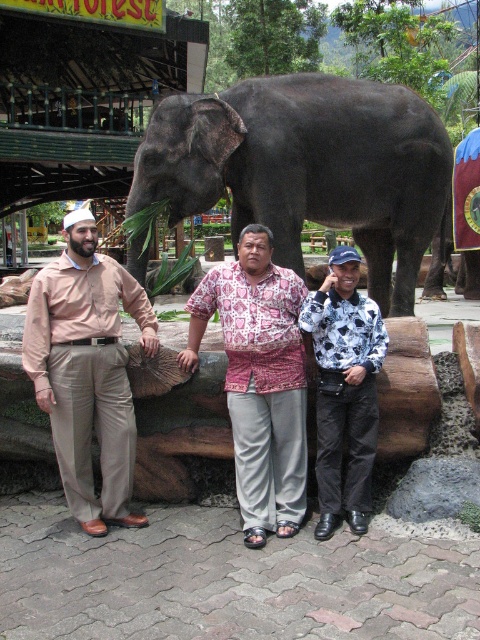
You are a photographer trying to capture a photo of the dark gray elephant at center and the white printed shirt at center. Based on their positions, which object is higher in the image?

The dark gray elephant at center is higher in the image than the white printed shirt at center according to the description.

You are a photographer standing in front of the dark gray elephant at center and the matte beige pants at left. Which object is closer to you?

The dark gray elephant at center is closer to you than the matte beige pants at left.

Based on the photo, you are a photographer at the zoo and want to ensure the dark gray elephant at center and the white printed shirt at center are both visible in the frame. Based on their positions, which one is closer to the left edge of the photo?

The dark gray elephant at center is positioned on the left side of white printed shirt at center, so it is closer to the left edge of the photo.